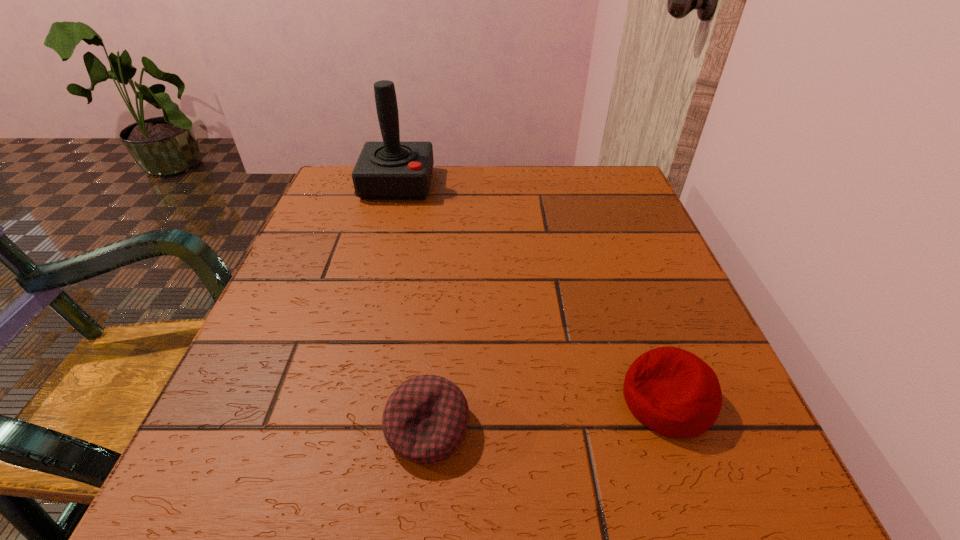
Identify the location of object at the left edge. This screenshot has height=540, width=960. (390, 170).

Where is `object that is at the right edge`? The image size is (960, 540). object that is at the right edge is located at coordinates (673, 392).

In order to click on object at the far left corner in this screenshot , I will do `click(390, 170)`.

The width and height of the screenshot is (960, 540). Identify the location of object that is positioned at the near right corner. tap(673, 392).

The height and width of the screenshot is (540, 960). In the image, there is a desktop. Identify the location of vacant space at the near edge. (507, 502).

At what (x,y) coordinates should I click in order to perform the action: click on blank space at the left edge of the desktop. Please return your answer as a coordinate pair (x, y). This screenshot has height=540, width=960. Looking at the image, I should click on (322, 237).

Image resolution: width=960 pixels, height=540 pixels. In the image, there is a desktop. Find the location of `vacant space at the right edge`. vacant space at the right edge is located at coordinates (605, 254).

In the image, there is a desktop. Where is `vacant region at the near left corner`? This screenshot has width=960, height=540. vacant region at the near left corner is located at coordinates 272,476.

Where is `vacant space at the far right corner of the desktop`? This screenshot has height=540, width=960. vacant space at the far right corner of the desktop is located at coordinates (586, 194).

In the image, there is a desktop. Where is `free space at the near right corner`? The image size is (960, 540). free space at the near right corner is located at coordinates (761, 458).